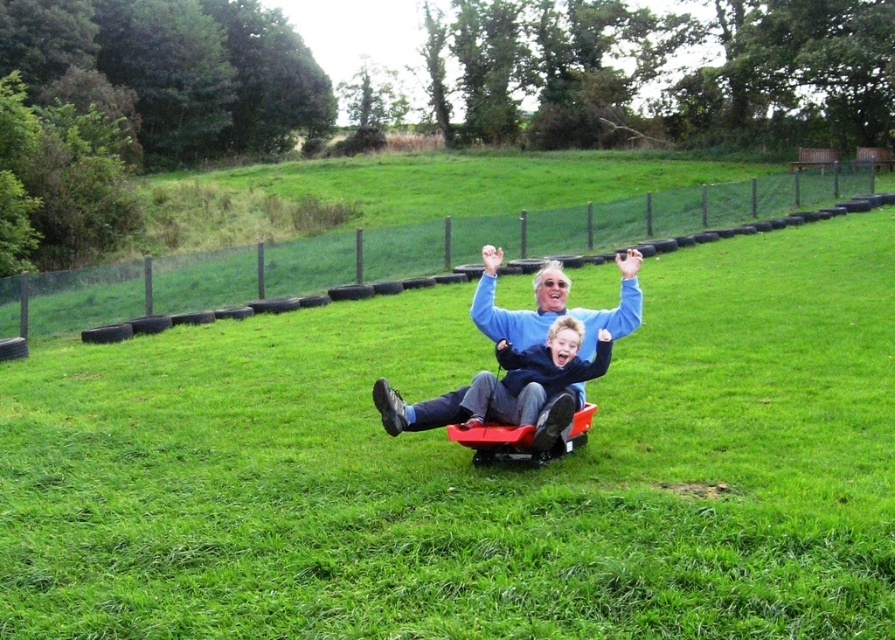
You are standing at the top of the grassy slope and see the blue smooth sweater at center and the red plastic wagon at center. Which object is closer to your right side?

The red plastic wagon at center is closer to your right side because the blue smooth sweater at center is to the left of it.

You are standing at the top of the slope and want to slide down to a specific spot. If you aim for point [412,404], will you pass point [553,438] before reaching your target?

Point [412,404] is behind point [553,438], so you will pass point [553,438] before reaching your target.

You are a photographer trying to capture a photo of the blue smooth sweater at center and the red plastic wagon at center. Which object should you focus on first if you want to ensure both are in focus?

The blue smooth sweater at center is above the red plastic wagon at center, so focusing on the red plastic wagon at center first would ensure both are in focus since it is closer to the camera.